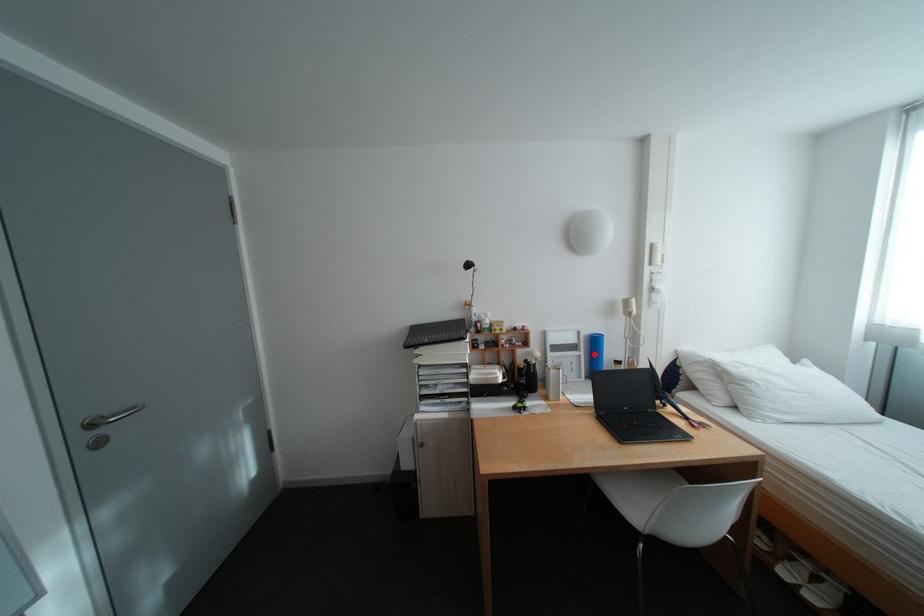
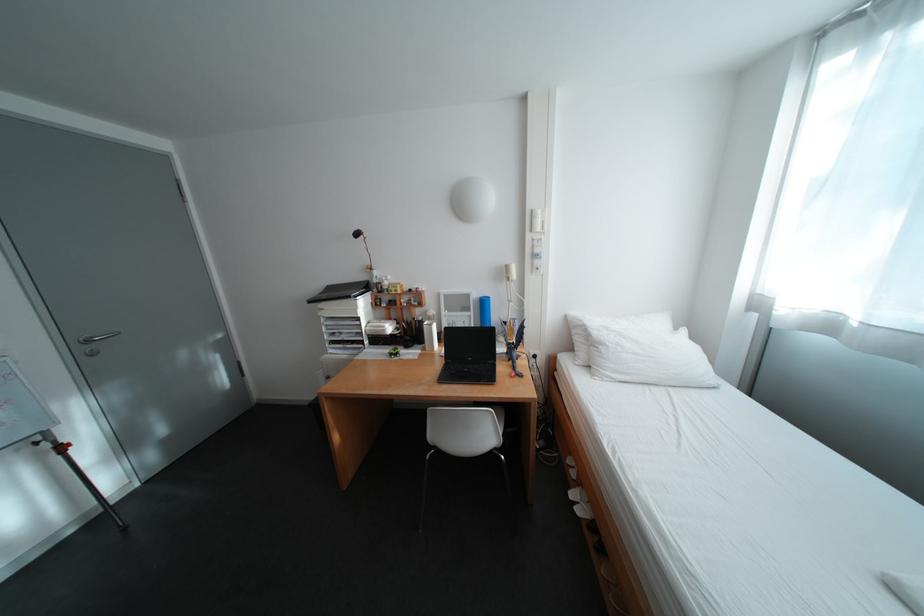
Locate, in the second image, the point that corresponds to the highlighted location in the first image.

(484, 314)